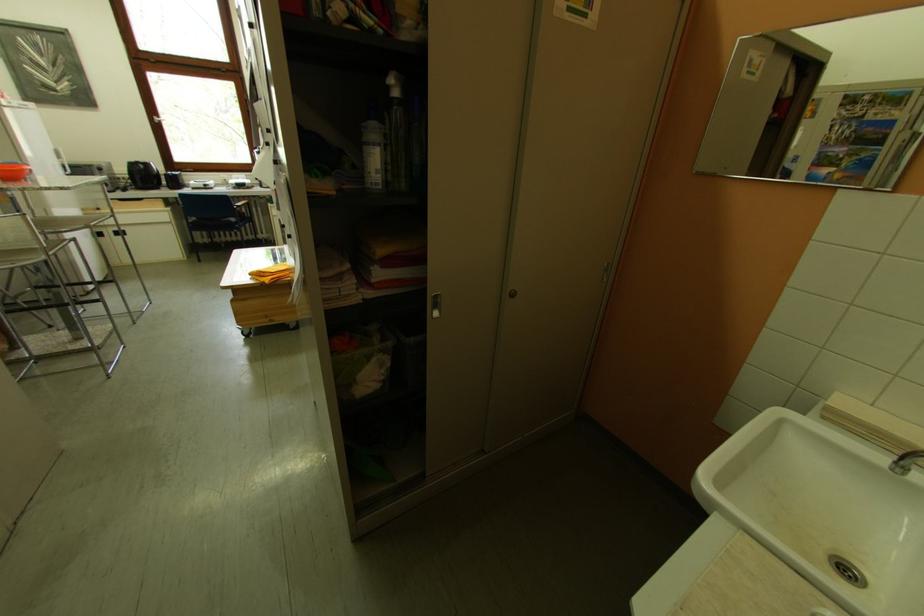
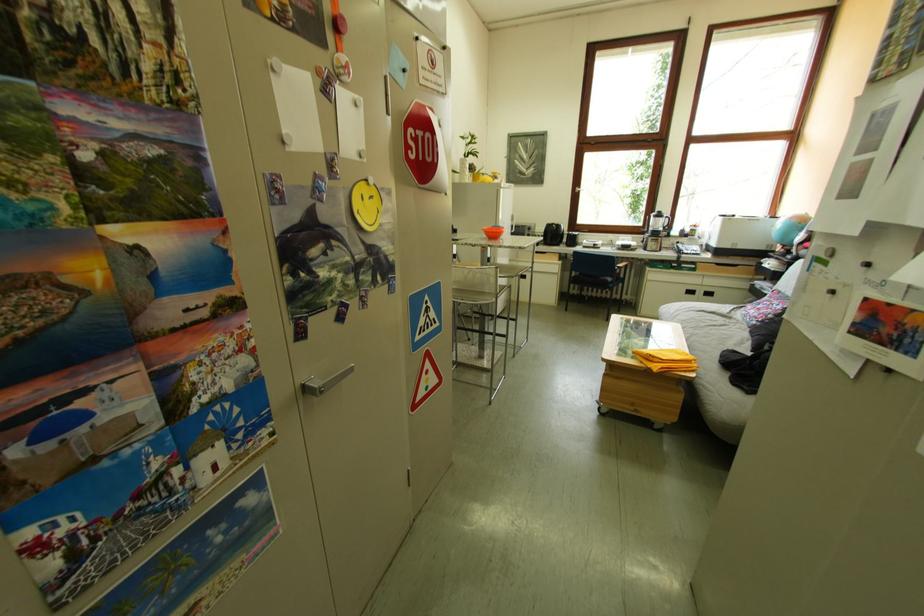
Question: The images are taken continuously from a first-person perspective. In which direction is your viewpoint rotating?

Choices:
 (A) Left
 (B) Right
 (C) Up
 (D) Down

Answer: (A)